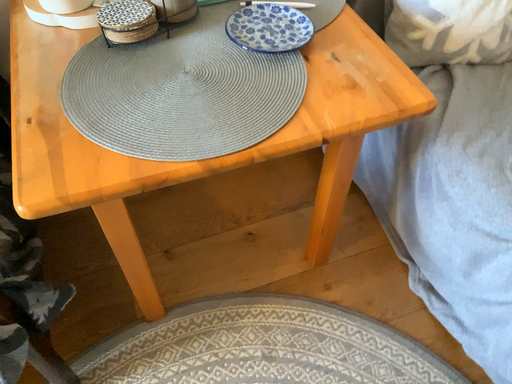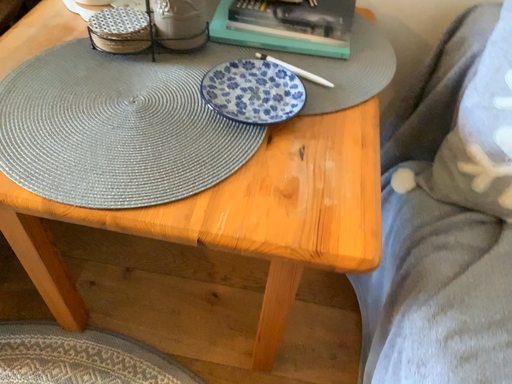
Question: Which way did the camera rotate in the video?

Choices:
 (A) rotated right
 (B) rotated left

Answer: (B)